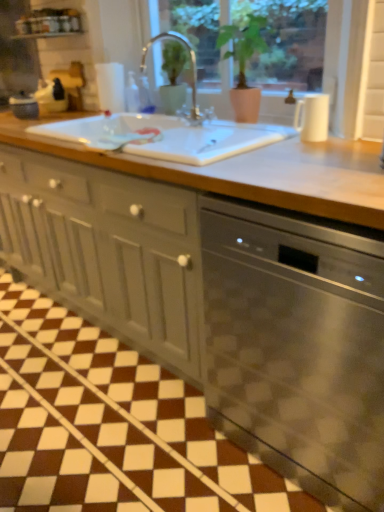
The height and width of the screenshot is (512, 384). I want to click on vacant area that is in front of white matte pitcher at upper right, arranged as the 1th appliance when viewed from the front, so click(x=328, y=146).